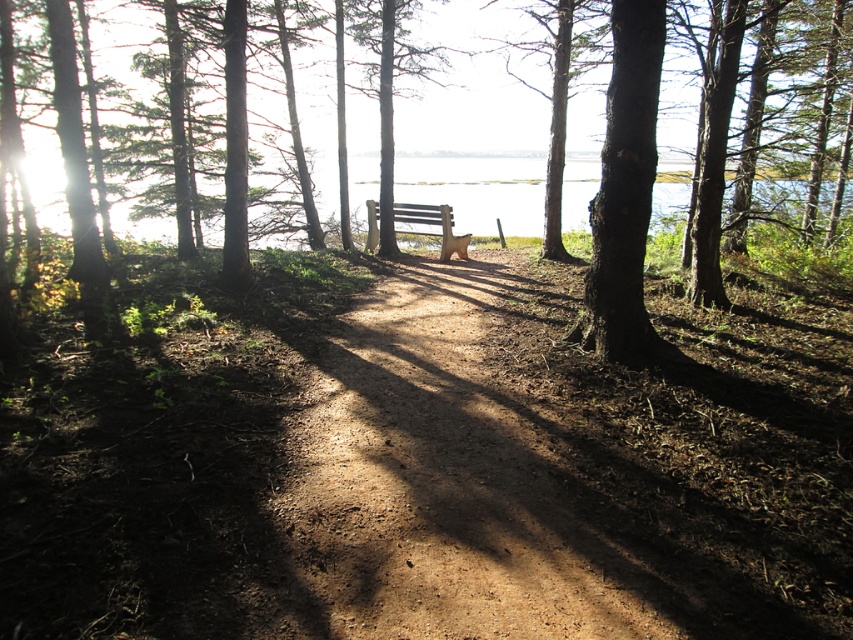
Question: In this image, where is dirt path at center located relative to brown wooden bench at center?

Choices:
 (A) right
 (B) left

Answer: (A)

Question: Can you confirm if dirt path at center is smaller than brown wooden bench at center?

Choices:
 (A) yes
 (B) no

Answer: (A)

Question: Can you confirm if dirt path at center is positioned above brown wooden bench at center?

Choices:
 (A) no
 (B) yes

Answer: (A)

Question: Which point is closer to the camera?

Choices:
 (A) brown wooden bench at center
 (B) dirt path at center

Answer: (B)

Question: Which of the following is the farthest from the observer?

Choices:
 (A) (343, 404)
 (B) (448, 243)

Answer: (B)